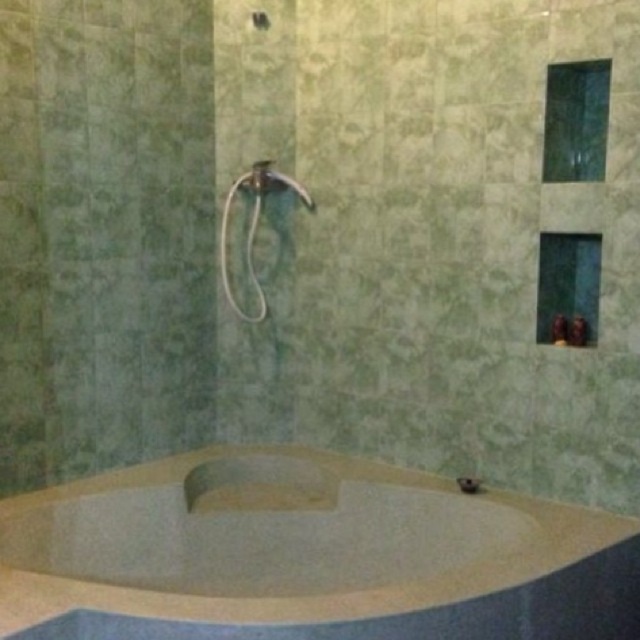
Can you confirm if beige stone jacuzzi at lower center is shorter than matte white showerhead at center?

Yes, beige stone jacuzzi at lower center is shorter than matte white showerhead at center.

Looking at this image, which is more to the right, beige stone jacuzzi at lower center or matte white showerhead at center?

beige stone jacuzzi at lower center is more to the right.

Is point (321, 579) in front of point (301, 196)?

Yes, it is in front of point (301, 196).

You are a GUI agent. You are given a task and a screenshot of the screen. Output one action in this format:
    pyautogui.click(x=<x>, y=<y>)
    Task: Click on the beige stone jacuzzi at lower center
    
    Given the screenshot: What is the action you would take?
    pyautogui.click(x=307, y=554)

Which is below, matte white showerhead at center or matte white showerhead at upper center?

matte white showerhead at center

This screenshot has height=640, width=640. Describe the element at coordinates (253, 225) in the screenshot. I see `matte white showerhead at center` at that location.

The image size is (640, 640). Find the location of `matte white showerhead at center`. matte white showerhead at center is located at coordinates (253, 225).

Is beige stone jacuzzi at lower center bigger than matte white showerhead at upper center?

Correct, beige stone jacuzzi at lower center is larger in size than matte white showerhead at upper center.

Between beige stone jacuzzi at lower center and matte white showerhead at upper center, which one appears on the right side from the viewer's perspective?

beige stone jacuzzi at lower center

Who is more distant from viewer, [204,500] or [298,189]?

Positioned behind is point [298,189].

Identify the location of beige stone jacuzzi at lower center. The image size is (640, 640). (307, 554).